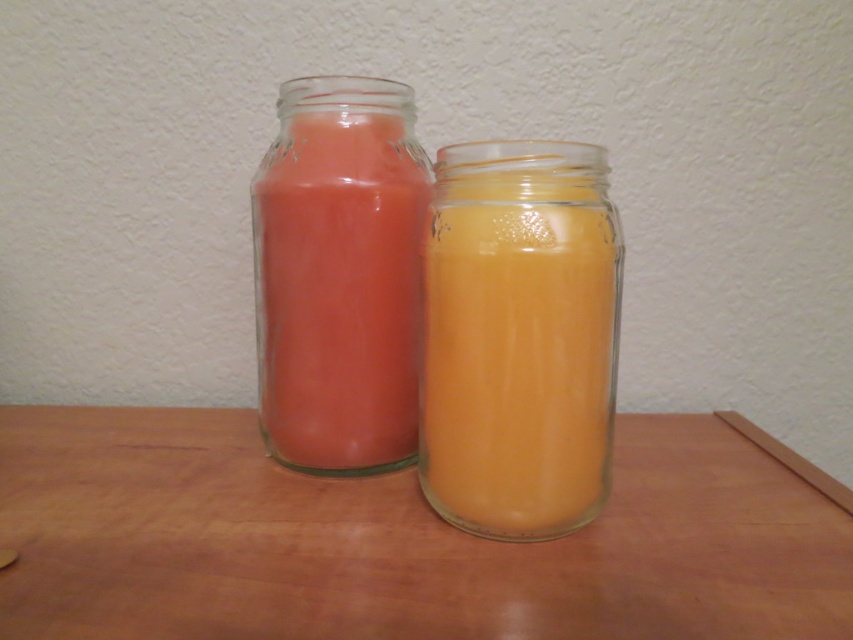
You are a delivery person who needs to place a package on the wooden table at center. However, there is a matte glass jar at center in the way. Can you move the jar to make space for the package?

The wooden table at center is in front of the matte glass jar at center, meaning the jar is closer to you. To place the package, you need to move the matte glass jar at center which is blocking the space on the wooden table at center.

You are trying to place a small decorative item on the wooden table at center, but you notice the matte glass jar at center is already there. Will the jar block the item from being placed on the table?

The wooden table at center has a lesser height compared to matte glass jar at center, so the jar might block the placement of the item if it is too tall. However, since the table is shorter, the jar could be positioned in a way that still allows space for the item.

You are standing 30 inches away from the wooden surface where the two glass jars are placed. There is a point labeled as point (10, 461) on the left jar. Can you reach that point without moving closer to the jars?

The distance of point (10, 461) from viewer is 27.45 inches. Since you are standing 30 inches away from the wooden surface, the point is 2.55 inches closer than your current position. Therefore, you cannot reach the point without moving closer to the jars.